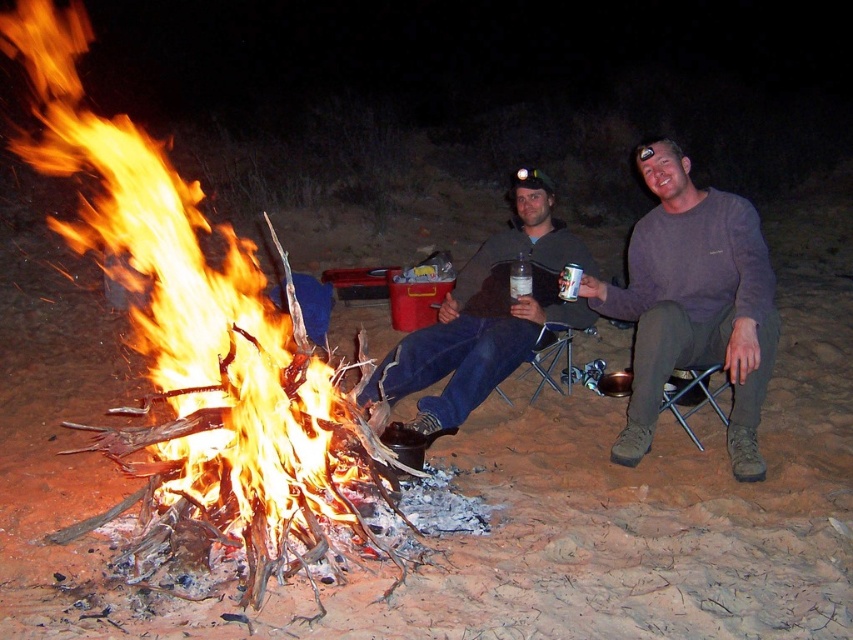
Looking at this image, you are a photographer trying to capture the scene of the campfire. You want to ensure that both the flaming wood fire at left and the matte black jacket at center are clearly visible in your photo. Which object should you adjust your camera focus on first to ensure proper exposure?

The flaming wood fire at left is above matte black jacket at center, so you should focus on the flaming wood fire at left first because it is closer to the camera and brighter, ensuring proper exposure for both subjects.

You are a photographer trying to capture a closeup shot of both the matte gray sweater at center and the purple sweater at center. Given that your camera can only focus on objects within a 0.5 inch range, will you be able to capture both sweaters in focus?

The matte gray sweater at center and purple sweater at center are 0.63 inches apart from each other. Since the camera can only focus within a 0.5 inch range, the distance between them exceeds the focus range. Therefore, you cannot capture both sweaters in focus simultaneously.